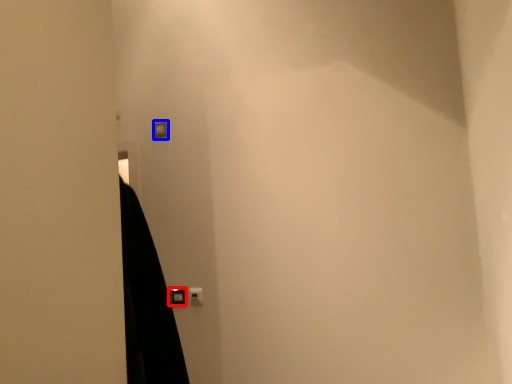
Question: Which object appears farthest to the camera in this image, door handle (highlighted by a red box) or light switch (highlighted by a blue box)?

Choices:
 (A) door handle
 (B) light switch

Answer: (B)